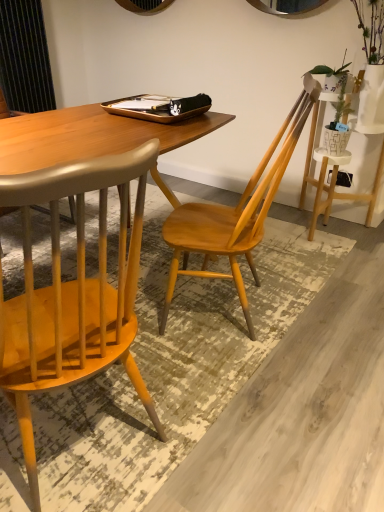
Where is `free location in front of light wood chair at center, the first chair from the right`? The height and width of the screenshot is (512, 384). free location in front of light wood chair at center, the first chair from the right is located at coordinates (201, 372).